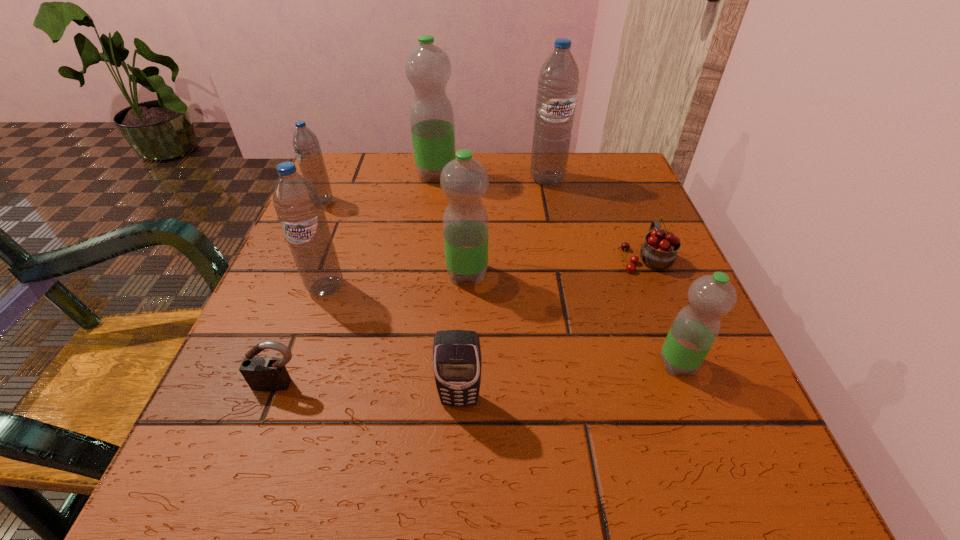
Where is `vacant area at the right edge of the desktop`? The height and width of the screenshot is (540, 960). vacant area at the right edge of the desktop is located at coordinates (630, 297).

Where is `vacant space at the far left corner of the desktop`? This screenshot has height=540, width=960. vacant space at the far left corner of the desktop is located at coordinates (377, 188).

This screenshot has width=960, height=540. I want to click on vacant region at the near left corner of the desktop, so click(286, 442).

The height and width of the screenshot is (540, 960). In the image, there is a desktop. Find the location of `vacant area at the far right corner`. vacant area at the far right corner is located at coordinates (618, 152).

You are a GUI agent. You are given a task and a screenshot of the screen. Output one action in this format:
    pyautogui.click(x=<x>, y=<y>)
    Task: Click on the free space between the farthest blue water bottle and the cherry
    This screenshot has width=960, height=540.
    Given the screenshot: What is the action you would take?
    pyautogui.click(x=596, y=218)

This screenshot has width=960, height=540. Identify the location of vacant area that lies between the padlock and the second nearest green water bottle. (373, 329).

At what (x,y) coordinates should I click in order to perform the action: click on vacant area between the cellular telephone and the smallest blue water bottle. Please return your answer as a coordinate pair (x, y). This screenshot has height=540, width=960. Looking at the image, I should click on (391, 300).

You are a GUI agent. You are given a task and a screenshot of the screen. Output one action in this format:
    pyautogui.click(x=<x>, y=<y>)
    Task: Click on the unoccupied position between the cellular telephone and the second biggest blue water bottle
    Image resolution: width=960 pixels, height=540 pixels.
    Given the screenshot: What is the action you would take?
    pyautogui.click(x=393, y=343)

The height and width of the screenshot is (540, 960). I want to click on free space between the smallest green water bottle and the seventh object from left to right, so click(612, 271).

This screenshot has width=960, height=540. Find the location of `free space that is in between the nearest water bottle and the seventh tallest object`. free space that is in between the nearest water bottle and the seventh tallest object is located at coordinates (568, 382).